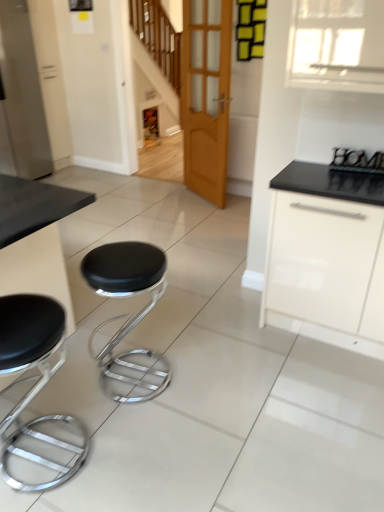
Question: Is white glossy cabinet at right directly adjacent to wooden door at center?

Choices:
 (A) no
 (B) yes

Answer: (A)

Question: From the image's perspective, is white glossy cabinet at right located beneath wooden door at center?

Choices:
 (A) no
 (B) yes

Answer: (B)

Question: Is white glossy cabinet at right taller than wooden door at center?

Choices:
 (A) yes
 (B) no

Answer: (B)

Question: From the image's perspective, does white glossy cabinet at right appear higher than wooden door at center?

Choices:
 (A) yes
 (B) no

Answer: (B)

Question: Are white glossy cabinet at right and wooden door at center located far from each other?

Choices:
 (A) no
 (B) yes

Answer: (B)

Question: Is white glossy cabinet at right wider than wooden door at center?

Choices:
 (A) no
 (B) yes

Answer: (B)

Question: Does white glossy cabinet at right lie behind black leather stool at center, which is the second stool from left to right?

Choices:
 (A) yes
 (B) no

Answer: (A)

Question: Is white glossy cabinet at right touching black leather stool at center, which appears as the first stool when viewed from the right?

Choices:
 (A) no
 (B) yes

Answer: (A)

Question: From a real-world perspective, is white glossy cabinet at right beneath black leather stool at center, which is the second stool from left to right?

Choices:
 (A) no
 (B) yes

Answer: (A)

Question: From the image's perspective, is white glossy cabinet at right located beneath black leather stool at center, which is the second stool from left to right?

Choices:
 (A) yes
 (B) no

Answer: (B)

Question: Does white glossy cabinet at right appear on the right side of black leather stool at center, which is the second stool from left to right?

Choices:
 (A) yes
 (B) no

Answer: (A)

Question: Can you confirm if white glossy cabinet at right is taller than black leather stool at center, which appears as the first stool when viewed from the right?

Choices:
 (A) no
 (B) yes

Answer: (B)

Question: Can you confirm if black leather stool at lower left, the 2th stool from the right, is wider than white glossy cabinet at right?

Choices:
 (A) yes
 (B) no

Answer: (B)